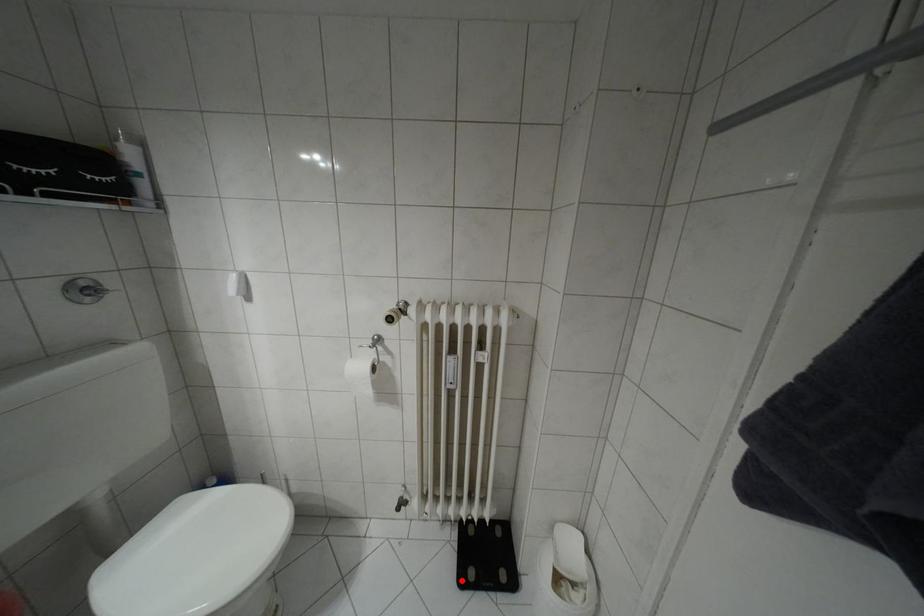
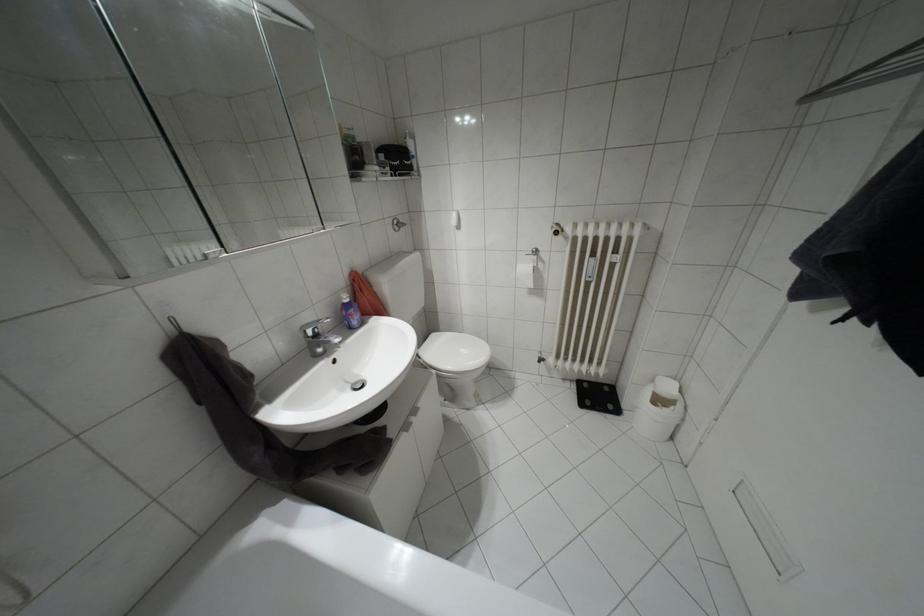
Question: A red point is marked in image1. In image2, is the corresponding 3D point closer to the camera or farther? Reply with the corresponding letter.

Choices:
 (A) The corresponding 3D point is closer.
 (B) The corresponding 3D point is farther.

Answer: (B)